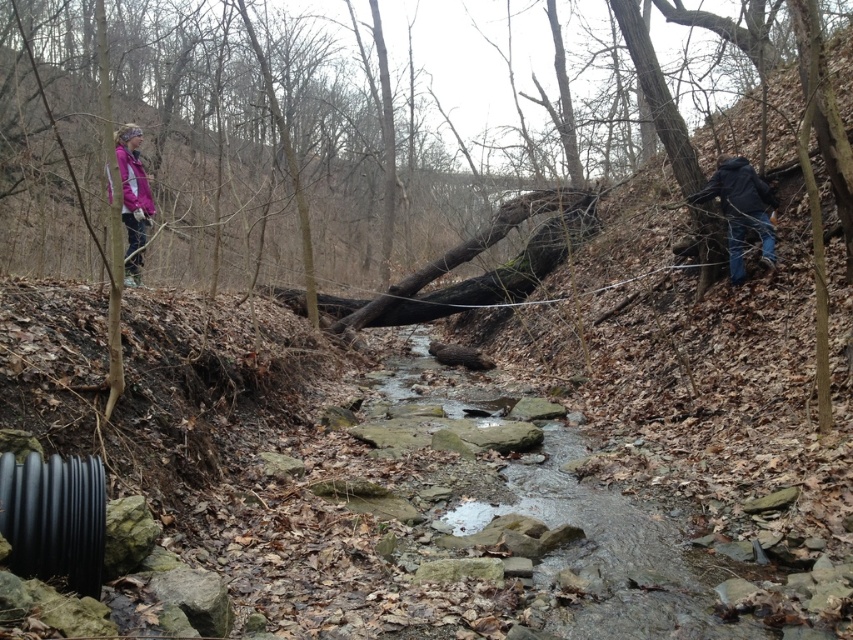
Question: Among these objects, which one is farthest from the camera?

Choices:
 (A) dark blue jacket at right
 (B) pink fleece jacket at upper left

Answer: (A)

Question: Can you confirm if clear water stream at center is thinner than dark blue jeans at right?

Choices:
 (A) no
 (B) yes

Answer: (A)

Question: Which object is farther from the camera taking this photo?

Choices:
 (A) dark blue jacket at right
 (B) dark blue jeans at right
 (C) clear water stream at center
 (D) matte purple jacket at upper left

Answer: (A)

Question: Does clear water stream at center have a lesser width compared to pink fleece jacket at upper left?

Choices:
 (A) yes
 (B) no

Answer: (B)

Question: Which point is closer to the camera?

Choices:
 (A) dark blue jacket at right
 (B) pink fleece jacket at upper left
 (C) clear water stream at center
 (D) matte purple jacket at upper left

Answer: (C)

Question: Does dark blue jeans at right come behind dark blue jacket at right?

Choices:
 (A) no
 (B) yes

Answer: (A)